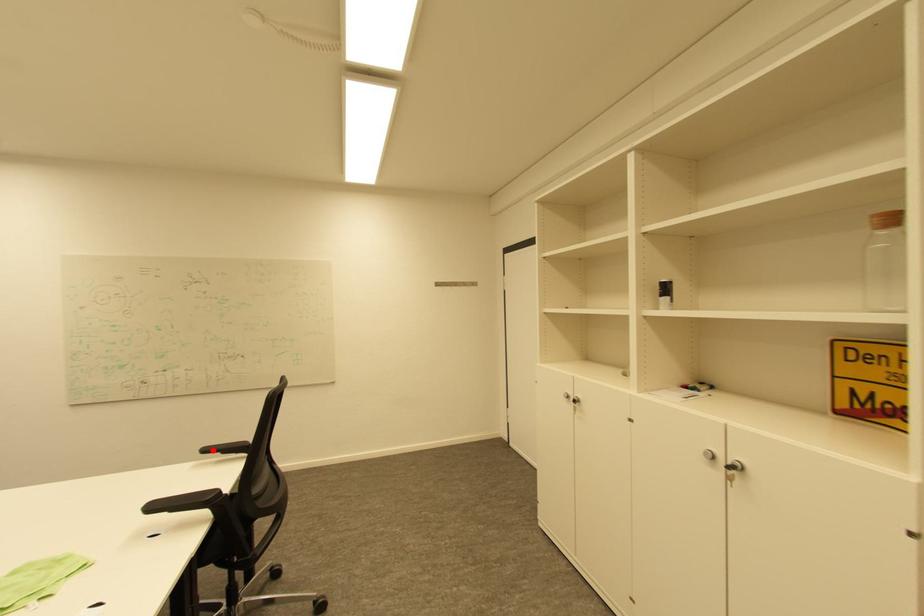
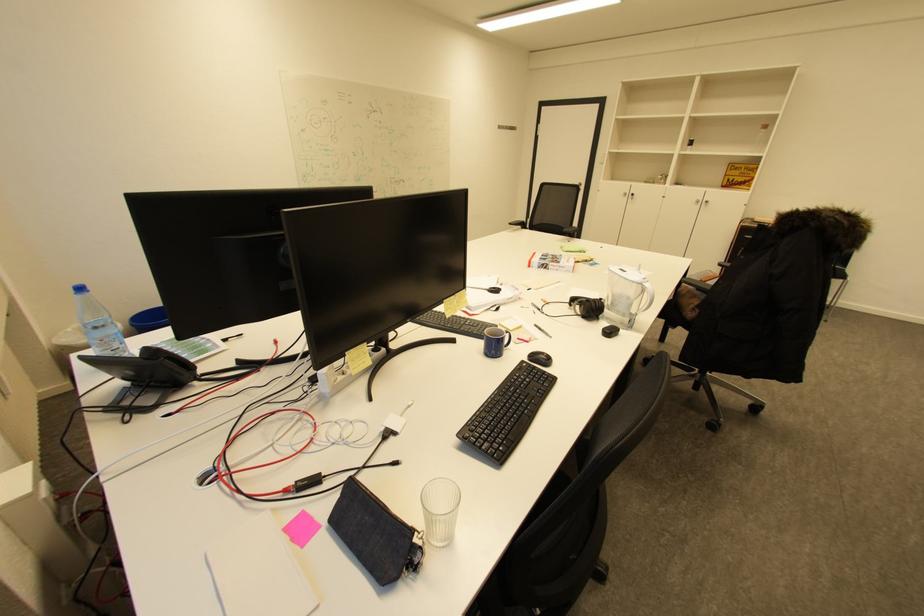
Where in the second image is the point corresponding to the highlighted location from the first image?

(517, 225)